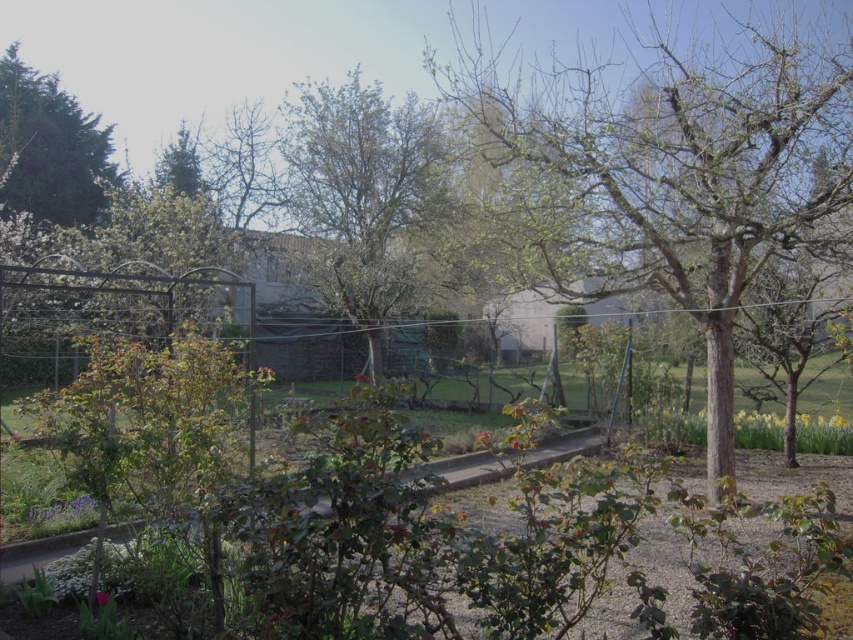
Question: Is green leafy tree at upper left positioned behind green matte tree at upper left?

Choices:
 (A) yes
 (B) no

Answer: (A)

Question: Does green leafy tree at center have a greater width compared to green matte tree at upper left?

Choices:
 (A) no
 (B) yes

Answer: (B)

Question: Can you confirm if metallic wire fence at left is positioned below green matte tree at upper left?

Choices:
 (A) no
 (B) yes

Answer: (B)

Question: Which point appears closest to the camera in this image?

Choices:
 (A) (184, 180)
 (B) (15, 333)
 (C) (786, 224)

Answer: (C)

Question: Which of the following is the farthest from the observer?

Choices:
 (A) (421, 154)
 (B) (177, 168)

Answer: (B)

Question: Which point is farther from the camera taking this photo?

Choices:
 (A) (570, 150)
 (B) (343, 240)

Answer: (B)